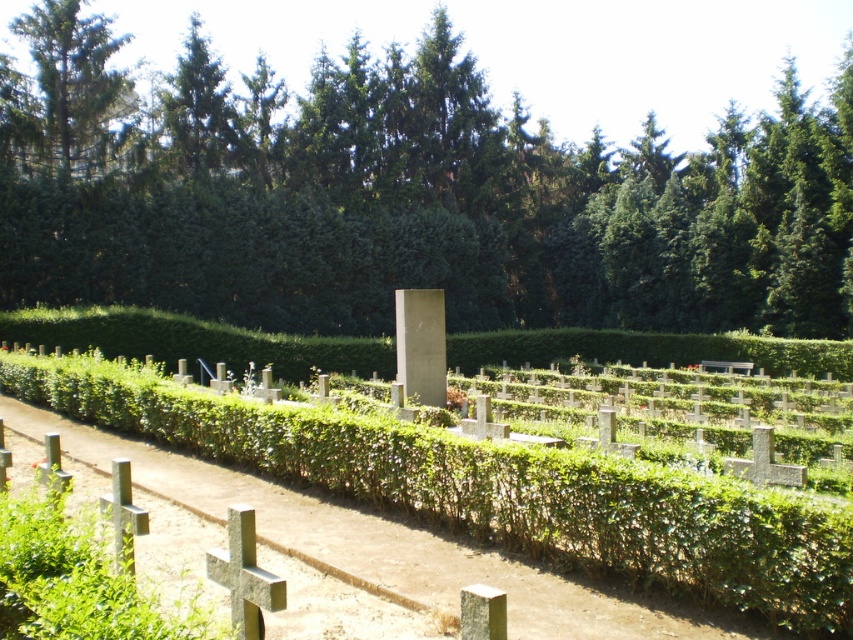
Who is taller, green hedge at center or green textured tree at upper left?

green textured tree at upper left is taller.

Is green hedge at center thinner than green textured tree at upper left?

No.

Is point (225, 474) closer to camera compared to point (21, 148)?

That is True.

This screenshot has height=640, width=853. Identify the location of green hedge at center. (379, 544).

Who is higher up, green leafy tree at center or green hedge at center?

Positioned higher is green leafy tree at center.

Between point (460, 74) and point (436, 584), which one is positioned behind?

The point (460, 74) is more distant.

Who is more distant from viewer, (355, 38) or (195, 467)?

Point (355, 38)

Locate an element on the screen. The width and height of the screenshot is (853, 640). green leafy tree at center is located at coordinates (405, 195).

Can you confirm if green leafy tree at center is wider than green textured tree at upper left?

Yes.

Does green leafy tree at center appear on the right side of green textured tree at upper left?

Indeed, green leafy tree at center is positioned on the right side of green textured tree at upper left.

What are the coordinates of `green leafy tree at center` in the screenshot? It's located at (405, 195).

The height and width of the screenshot is (640, 853). Identify the location of green leafy tree at center. (405, 195).